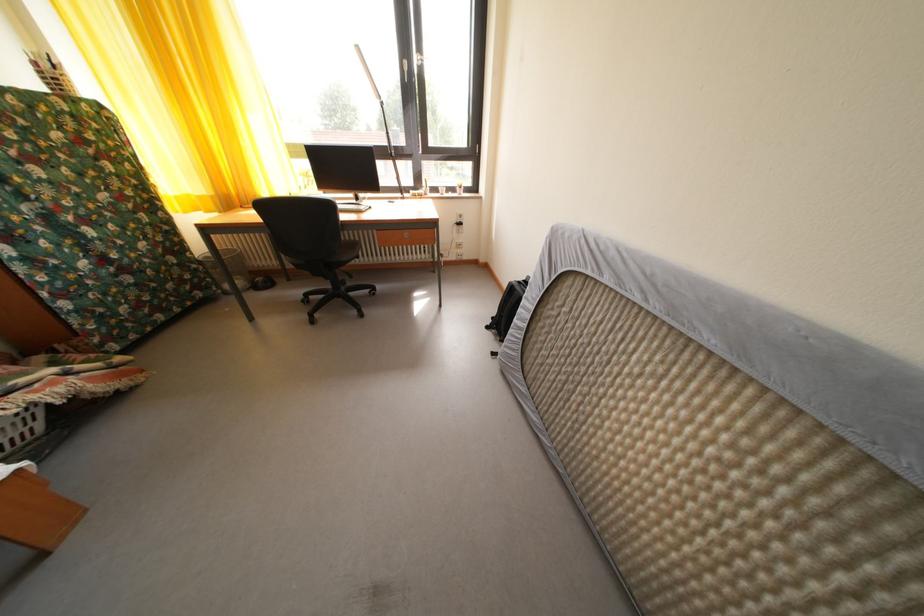
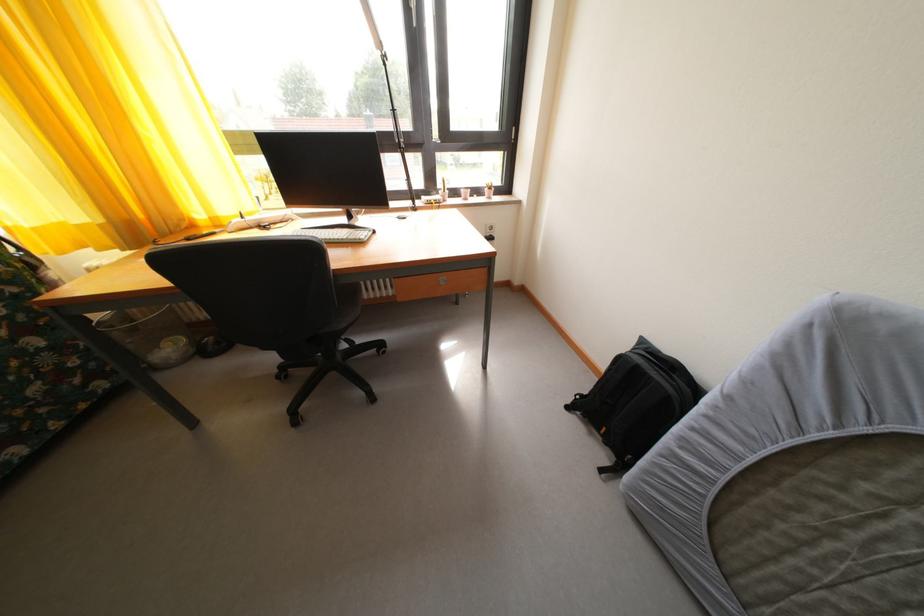
Question: The camera is either moving clockwise (left) or counter-clockwise (right) around the object. The first image is from the beginning of the video and the second image is from the end. Is the camera moving left or right when shooting the video?

Choices:
 (A) Left
 (B) Right

Answer: (A)